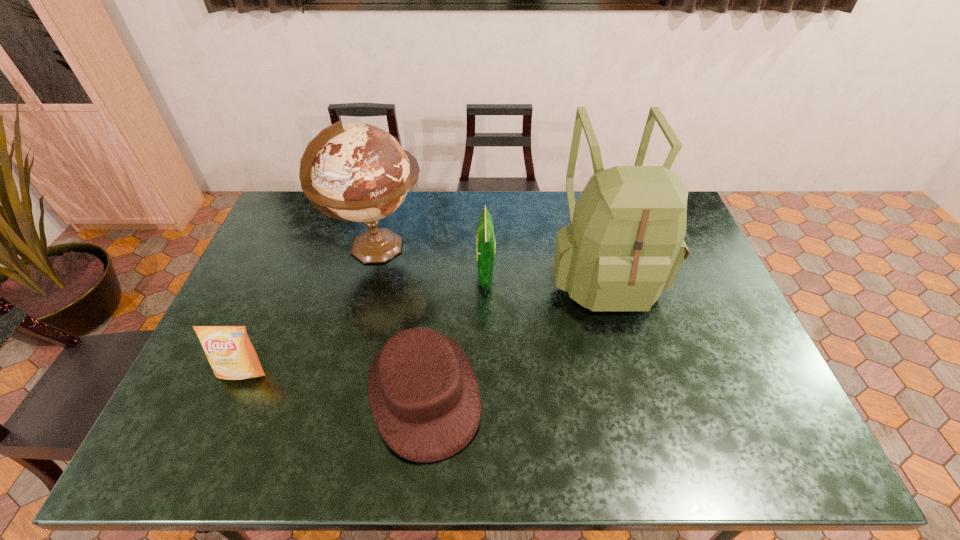
Where is `free region located 0.380m on the front-facing side of the farther crisp (potato chip)`? free region located 0.380m on the front-facing side of the farther crisp (potato chip) is located at coordinates (356, 275).

Locate an element on the screen. free space located on the front-facing side of the farther crisp (potato chip) is located at coordinates (381, 275).

Where is `vacant space located on the front-facing side of the shorter crisp (potato chip)`? Image resolution: width=960 pixels, height=540 pixels. vacant space located on the front-facing side of the shorter crisp (potato chip) is located at coordinates (216, 434).

Where is `blank area located on the back of the hat`? The width and height of the screenshot is (960, 540). blank area located on the back of the hat is located at coordinates (435, 280).

Locate an element on the screen. The image size is (960, 540). globe located in the far edge section of the desktop is located at coordinates (360, 173).

The image size is (960, 540). Identify the location of backpack located at the far edge. (625, 245).

At what (x,y) coordinates should I click in order to perform the action: click on object positioned at the near edge. Please return your answer as a coordinate pair (x, y). Image resolution: width=960 pixels, height=540 pixels. Looking at the image, I should click on (424, 397).

At what (x,y) coordinates should I click in order to perform the action: click on object that is positioned at the left edge. Please return your answer as a coordinate pair (x, y). Image resolution: width=960 pixels, height=540 pixels. Looking at the image, I should click on (228, 349).

Where is `vacant space at the far edge of the desktop`? The width and height of the screenshot is (960, 540). vacant space at the far edge of the desktop is located at coordinates (517, 204).

Identify the location of vacant space at the near edge. The height and width of the screenshot is (540, 960). (672, 466).